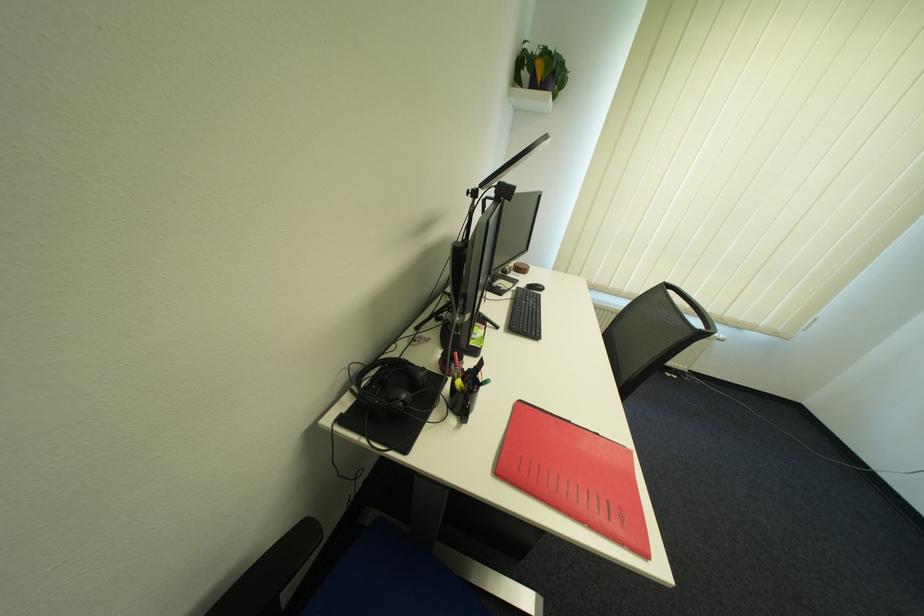
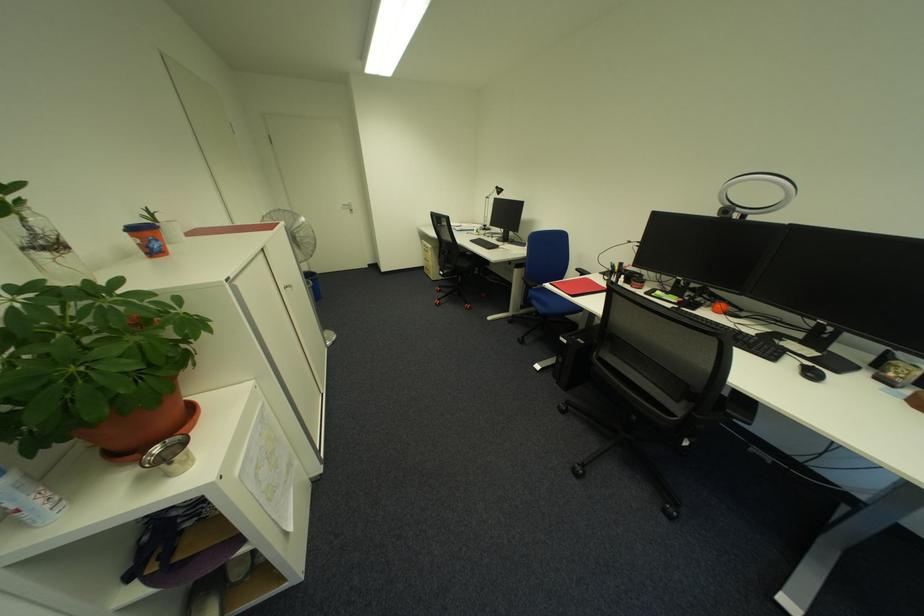
Find the pixel in the second image that matches the point at 657,557 in the first image.

(560, 285)